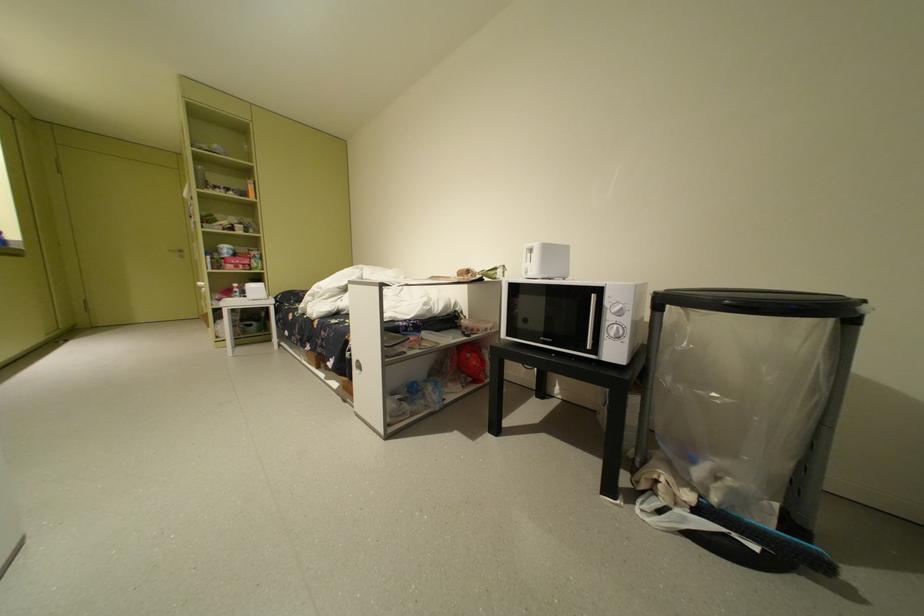
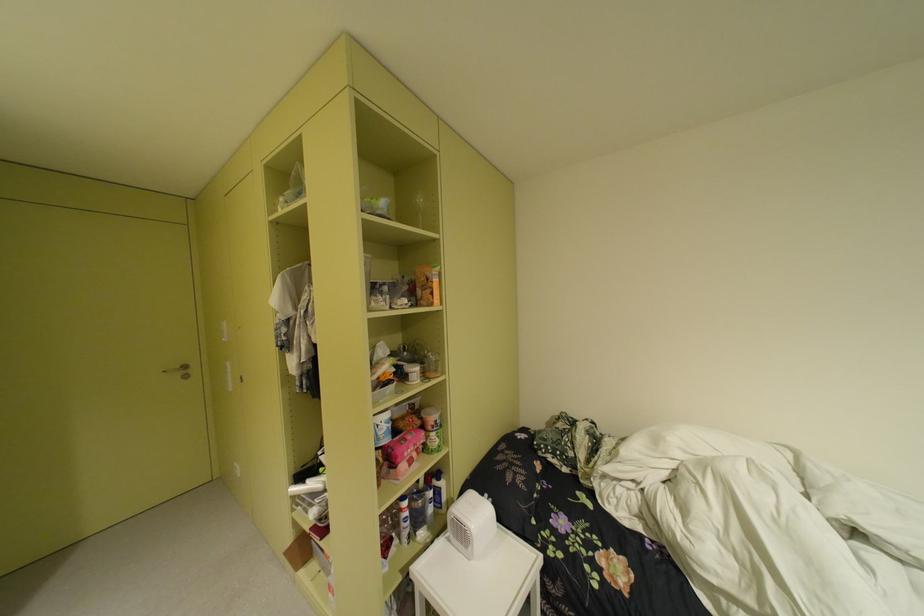
Which direction would the cameraman need to move to produce the second image?

The cameraman walked toward left, forward.